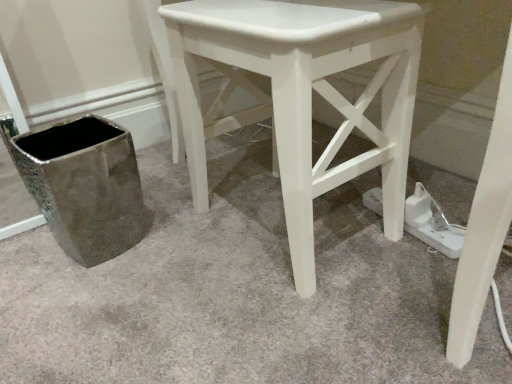
What do you see at coordinates (303, 95) in the screenshot? The width and height of the screenshot is (512, 384). I see `white glossy stool at center` at bounding box center [303, 95].

Based on the photo, measure the distance between point (189,137) and camera.

Point (189,137) is 35.59 inches away from camera.

Where is `white glossy stool at center`? This screenshot has height=384, width=512. white glossy stool at center is located at coordinates (303, 95).

Identify the location of white glossy stool at center. This screenshot has height=384, width=512. (303, 95).